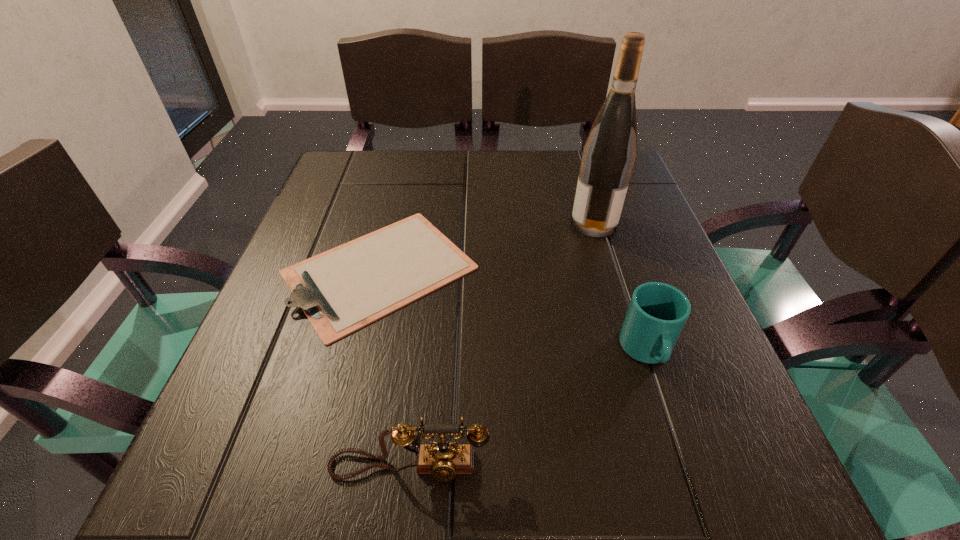
I want to click on wine bottle, so click(609, 153).

At what (x,y) coordinates should I click in order to perform the action: click on cup. Please return your answer as a coordinate pair (x, y). The width and height of the screenshot is (960, 540). Looking at the image, I should click on (657, 313).

In order to click on telephone in this screenshot , I will do `click(443, 460)`.

Locate an element on the screen. The image size is (960, 540). clipboard is located at coordinates (341, 290).

The height and width of the screenshot is (540, 960). I want to click on free space located 0.320m on the front of the tallest object, so click(638, 367).

Find the location of a particular element. Image resolution: width=960 pixels, height=540 pixels. free point located on the handle side of the cup is located at coordinates (680, 452).

The image size is (960, 540). Find the location of `free space located on the front of the shortest object`. free space located on the front of the shortest object is located at coordinates (346, 414).

Find the location of a particular element. object that is at the near edge is located at coordinates (443, 460).

Identify the location of object that is at the left edge. (341, 290).

Find the location of `wine bottle located at the right edge`. wine bottle located at the right edge is located at coordinates (609, 153).